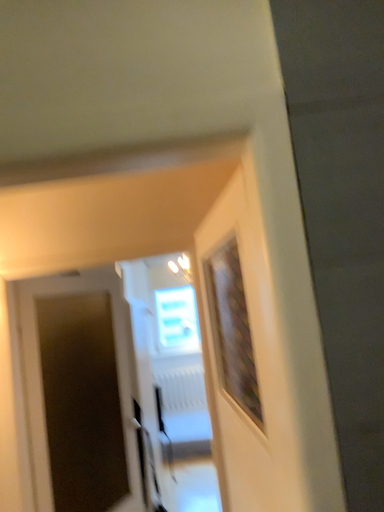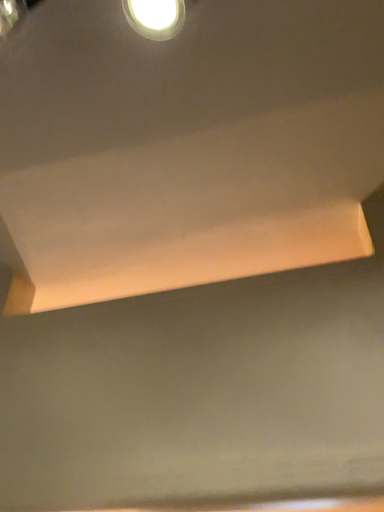
Question: How did the camera likely rotate when shooting the video?

Choices:
 (A) rotated left
 (B) rotated right

Answer: (A)